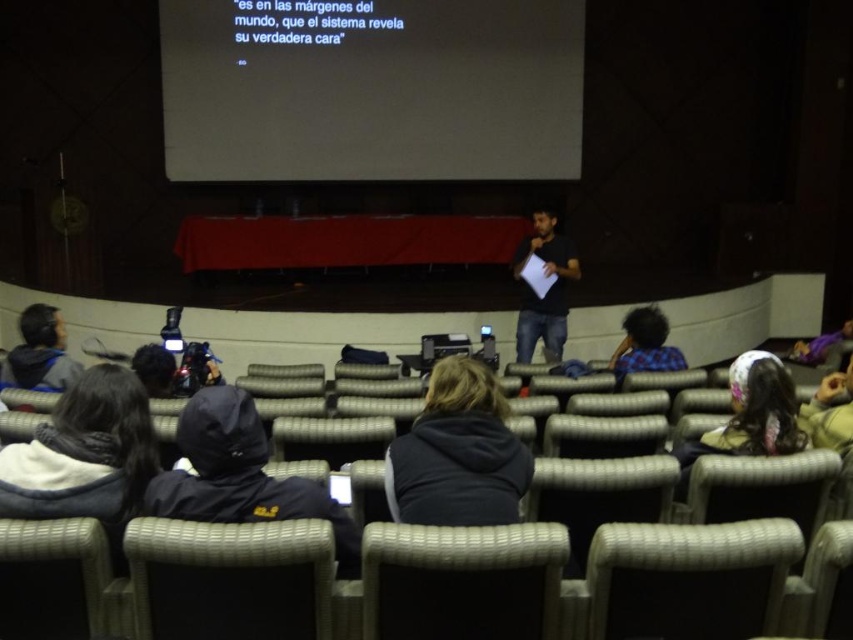
Question: Is black matte screen at upper center to the right of dark blue hoodie at lower left from the viewer's perspective?

Choices:
 (A) no
 (B) yes

Answer: (B)

Question: Which point is closer to the camera?

Choices:
 (A) (4, 461)
 (B) (564, 35)

Answer: (A)

Question: Considering the real-world distances, which object is farthest from the dark blue hoodie at lower left?

Choices:
 (A) woven fabric chair at lower center
 (B) dark blue jeans at center
 (C) gray fabric chair at center

Answer: (B)

Question: Is woven fabric chair at lower center above dark blue jeans at center?

Choices:
 (A) no
 (B) yes

Answer: (A)

Question: Can you confirm if dark gray hoodie at lower left is thinner than dark blue hooded jacket at lower left?

Choices:
 (A) no
 (B) yes

Answer: (B)

Question: Among these objects, which one is farthest from the camera?

Choices:
 (A) dark blue hoodie at lower left
 (B) dark gray hoodie at center

Answer: (A)